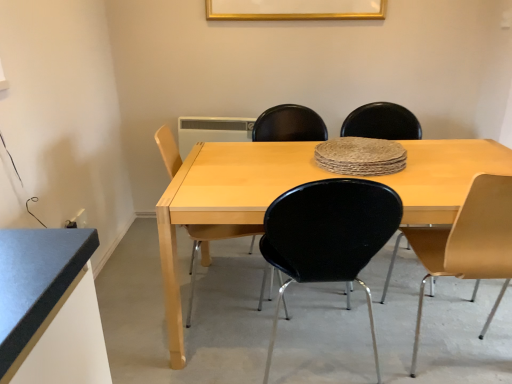
I want to click on vacant space behind light wood/black plastic chair at center, which is the 4th chair from right to left, so click(x=212, y=270).